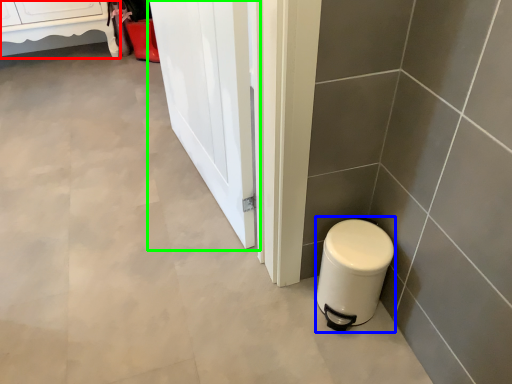
Question: Based on their relative distances, which object is farther from furniture (highlighted by a red box)? Choose from appliance (highlighted by a blue box) and screen door (highlighted by a green box).

Choices:
 (A) appliance
 (B) screen door

Answer: (A)